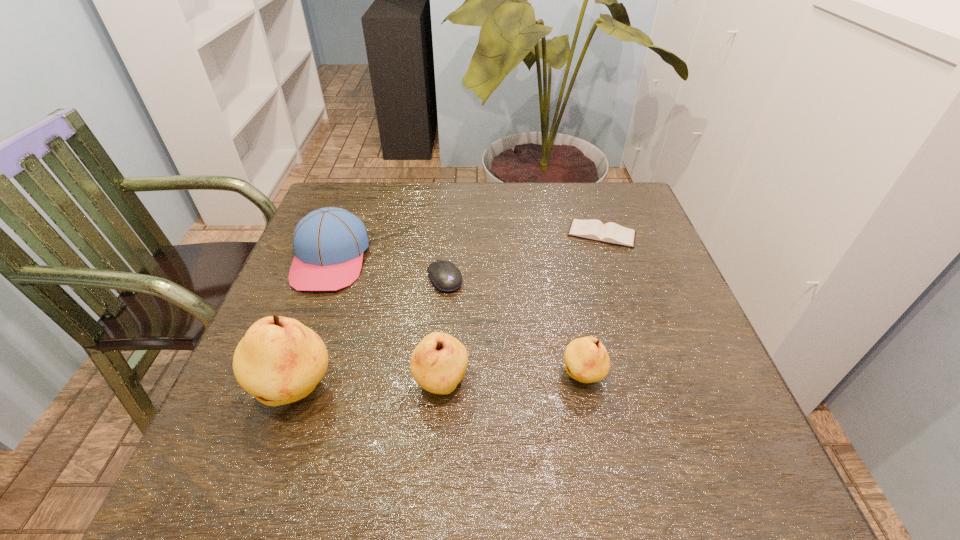
Where is `vacant space situated 0.120m on the left of the rightmost pear`? vacant space situated 0.120m on the left of the rightmost pear is located at coordinates click(x=497, y=377).

The image size is (960, 540). Identify the location of vacant space situated 0.140m on the back of the computer mouse. (449, 229).

Image resolution: width=960 pixels, height=540 pixels. I want to click on vacant space positioned on the front of the diary, so click(x=621, y=294).

Where is `vacant area situated on the front-facing side of the baseball cap`? This screenshot has height=540, width=960. vacant area situated on the front-facing side of the baseball cap is located at coordinates (287, 374).

Find the location of `diary that is at the far edge`. diary that is at the far edge is located at coordinates (612, 233).

The height and width of the screenshot is (540, 960). I want to click on baseball cap present at the far edge, so click(328, 243).

The image size is (960, 540). I want to click on pear present at the left edge, so click(279, 360).

Find the location of a particular element. The image size is (960, 540). baseball cap at the left edge is located at coordinates (328, 243).

I want to click on object present at the right edge, so click(x=612, y=233).

You are a GUI agent. You are given a task and a screenshot of the screen. Output one action in this format:
    pyautogui.click(x=<x>, y=<y>)
    Task: Click on the object that is at the far left corner
    The image size is (960, 540).
    Given the screenshot: What is the action you would take?
    pyautogui.click(x=328, y=243)